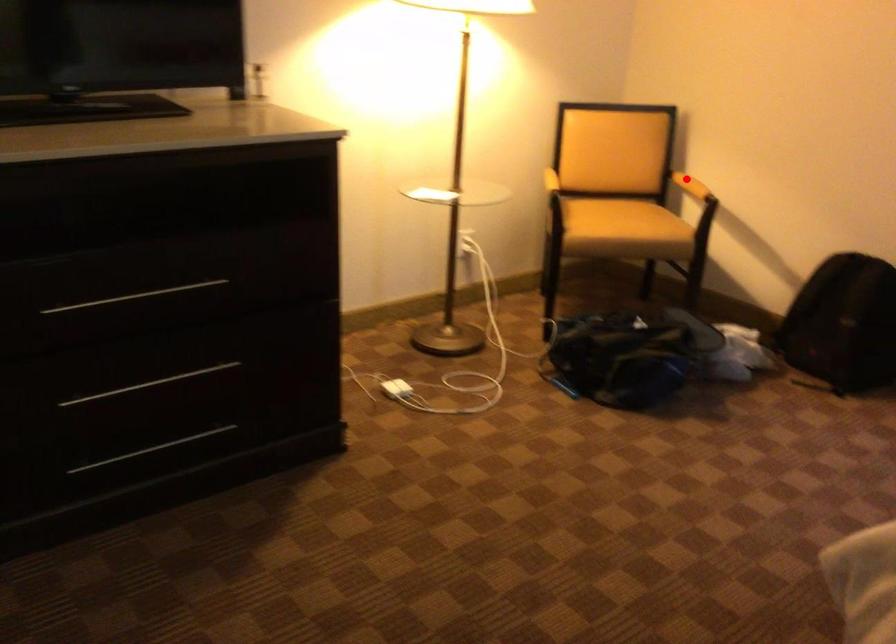
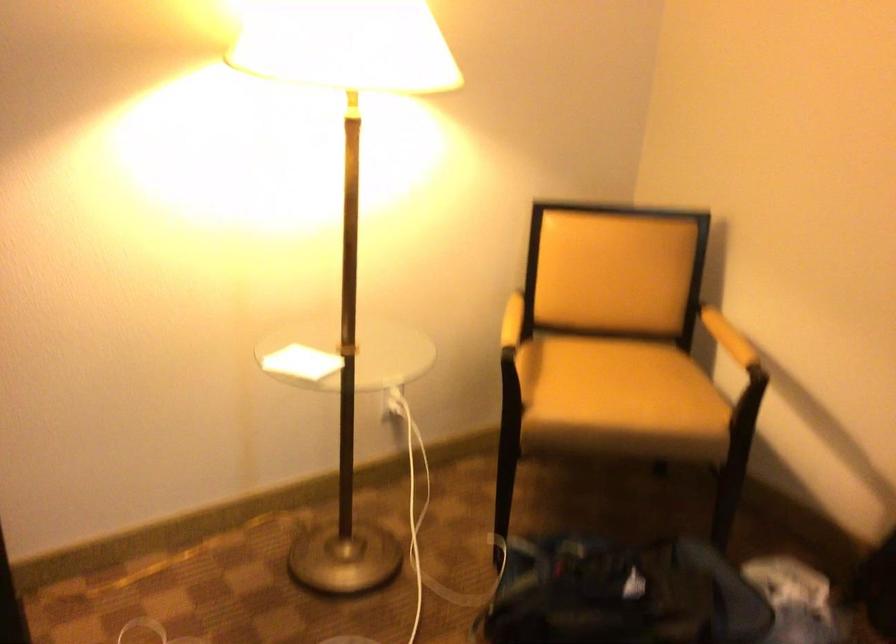
In the second image, find the point that corresponds to the highlighted location in the first image.

(728, 337)